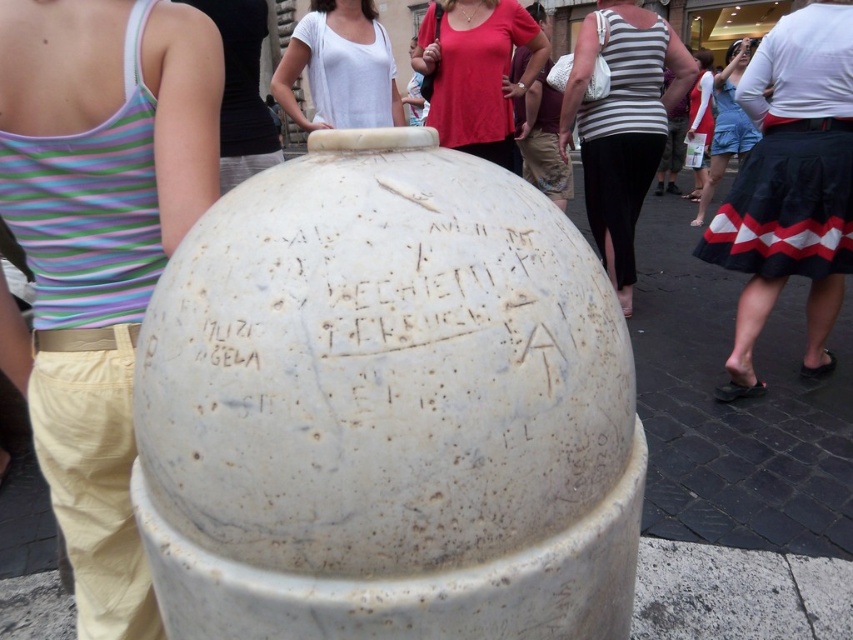
Is black and white zigzag skirt at center wider than striped fabric tank top at center?

Indeed, black and white zigzag skirt at center has a greater width compared to striped fabric tank top at center.

Does black and white zigzag skirt at center lie behind striped fabric tank top at center?

No, it is not.

Find the location of a particular element. The width and height of the screenshot is (853, 640). black and white zigzag skirt at center is located at coordinates (790, 186).

Find the location of a particular element. This screenshot has width=853, height=640. black and white zigzag skirt at center is located at coordinates (790, 186).

Which of these two, white marble vase at center or matte red t-shirt at center, stands shorter?

white marble vase at center is shorter.

Does white marble vase at center have a lesser height compared to matte red t-shirt at center?

Yes, white marble vase at center is shorter than matte red t-shirt at center.

Consider the image. Who is more forward, [627,548] or [485,28]?

Point [627,548]

The width and height of the screenshot is (853, 640). I want to click on white marble vase at center, so (x=387, y=408).

Between matte red t-shirt at center and white cotton tank top at upper center, which one has less height?

Standing shorter between the two is white cotton tank top at upper center.

Who is positioned more to the right, matte red t-shirt at center or white cotton tank top at upper center?

From the viewer's perspective, matte red t-shirt at center appears more on the right side.

Which is in front, point (502, 81) or point (397, 104)?

Positioned in front is point (397, 104).

At what (x,y) coordinates should I click in order to perform the action: click on matte red t-shirt at center. Please return your answer as a coordinate pair (x, y). Looking at the image, I should click on coord(476,72).